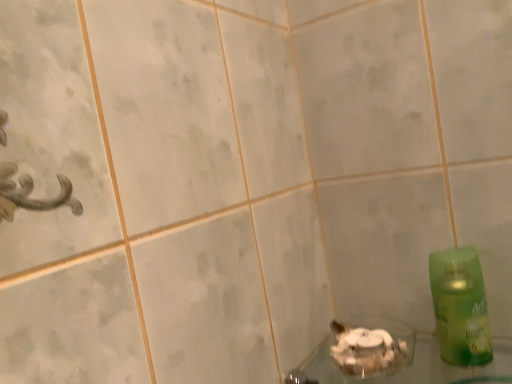
Question: Does green plastic bottle at right have a lesser height compared to clear glass bowl at lower center?

Choices:
 (A) no
 (B) yes

Answer: (A)

Question: Does green plastic bottle at right appear on the right side of clear glass bowl at lower center?

Choices:
 (A) yes
 (B) no

Answer: (A)

Question: From a real-world perspective, does green plastic bottle at right sit lower than clear glass bowl at lower center?

Choices:
 (A) yes
 (B) no

Answer: (B)

Question: Can you confirm if green plastic bottle at right is positioned to the left of clear glass bowl at lower center?

Choices:
 (A) yes
 (B) no

Answer: (B)

Question: Is clear glass bowl at lower center completely or partially inside green plastic bottle at right?

Choices:
 (A) no
 (B) yes

Answer: (A)

Question: Is green plastic bottle at right taller than clear glass bowl at lower center?

Choices:
 (A) yes
 (B) no

Answer: (A)

Question: Would you say clear glass bowl at lower center contains green plastic bottle at right?

Choices:
 (A) yes
 (B) no

Answer: (B)

Question: Can you confirm if clear glass bowl at lower center is smaller than green plastic bottle at right?

Choices:
 (A) no
 (B) yes

Answer: (A)

Question: Is clear glass bowl at lower center far away from green plastic bottle at right?

Choices:
 (A) yes
 (B) no

Answer: (B)

Question: Can you confirm if clear glass bowl at lower center is taller than green plastic bottle at right?

Choices:
 (A) no
 (B) yes

Answer: (A)

Question: From the image's perspective, is clear glass bowl at lower center located beneath green plastic bottle at right?

Choices:
 (A) yes
 (B) no

Answer: (A)

Question: From a real-world perspective, is clear glass bowl at lower center over green plastic bottle at right?

Choices:
 (A) no
 (B) yes

Answer: (A)

Question: From the image's perspective, is clear glass bowl at lower center above or below green plastic bottle at right?

Choices:
 (A) below
 (B) above

Answer: (A)